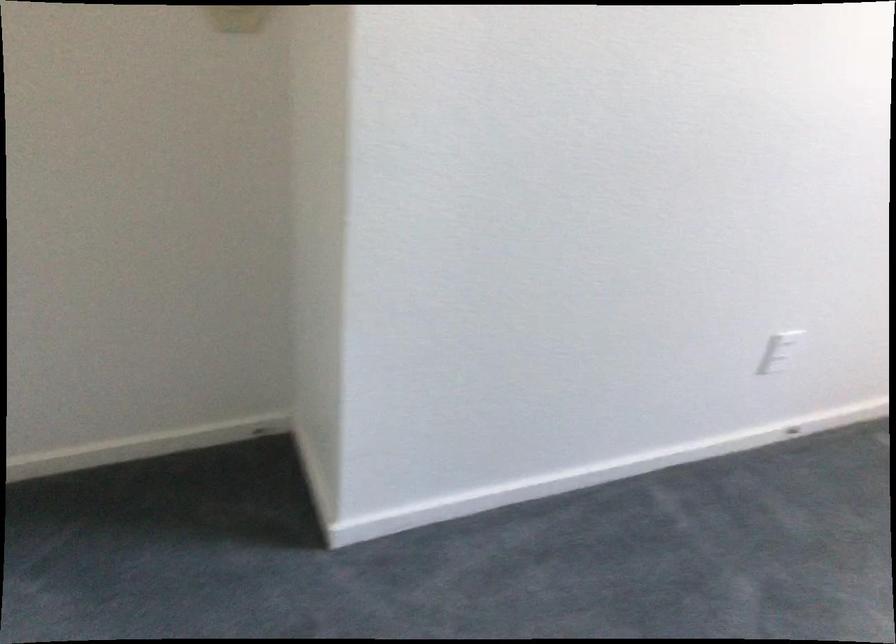
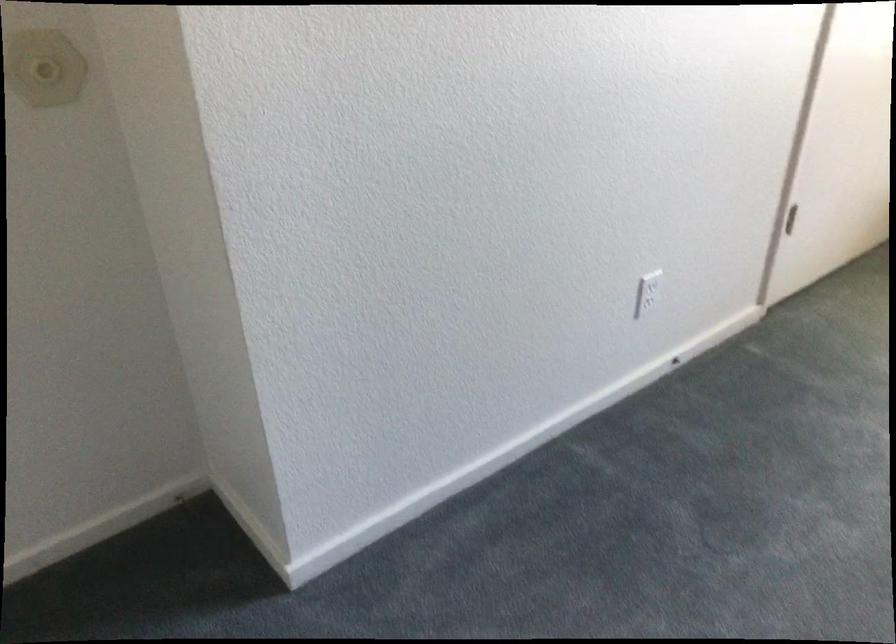
In the second image, find the point that corresponds to point 780,346 in the first image.

(650, 285)